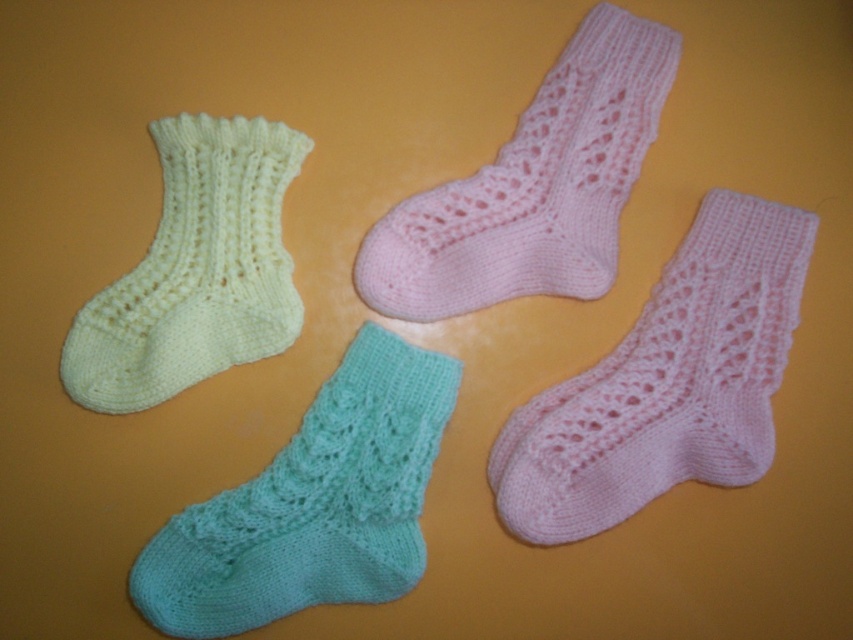
You are organizing a sock drawer and need to place a new sock exactly at point (666, 381). The drawer has a maximum height of 0.8. Will the pink knitted sock at center fit vertically at that point?

The pink knitted sock at center is located at point (666, 381). Since the drawer has a maximum height of 0.8, the sock will fit vertically as its position is below the maximum height limit.

You are organizing a sock drawer and need to place the pink knitted sock at upper center and the light yellow knitted sock at left. If your drawer has a width of 30 centimeters, will both socks fit side by side without overlapping?

The pink knitted sock at upper center is 28.16 centimeters from the light yellow knitted sock at left, which means the total width required would be approximately 28.16 centimeters. Since the drawer is 30 centimeters wide, there is enough space for both socks to fit side by side without overlapping.